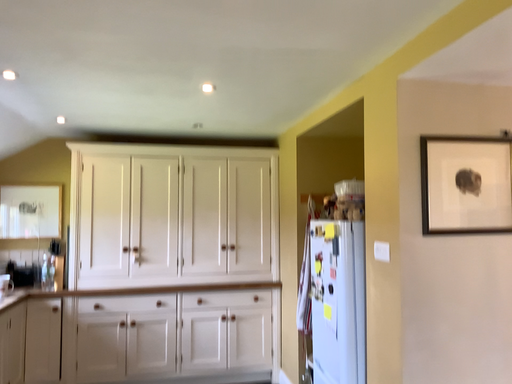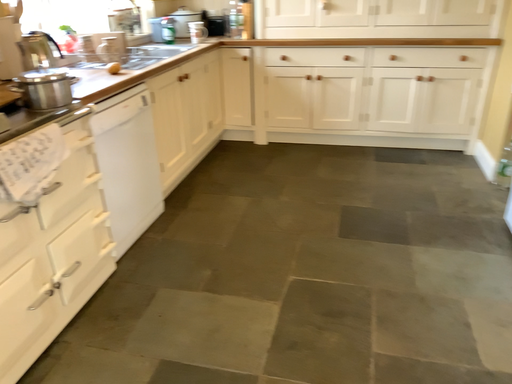
Question: Which way did the camera rotate in the video?

Choices:
 (A) rotated right
 (B) rotated left

Answer: (B)